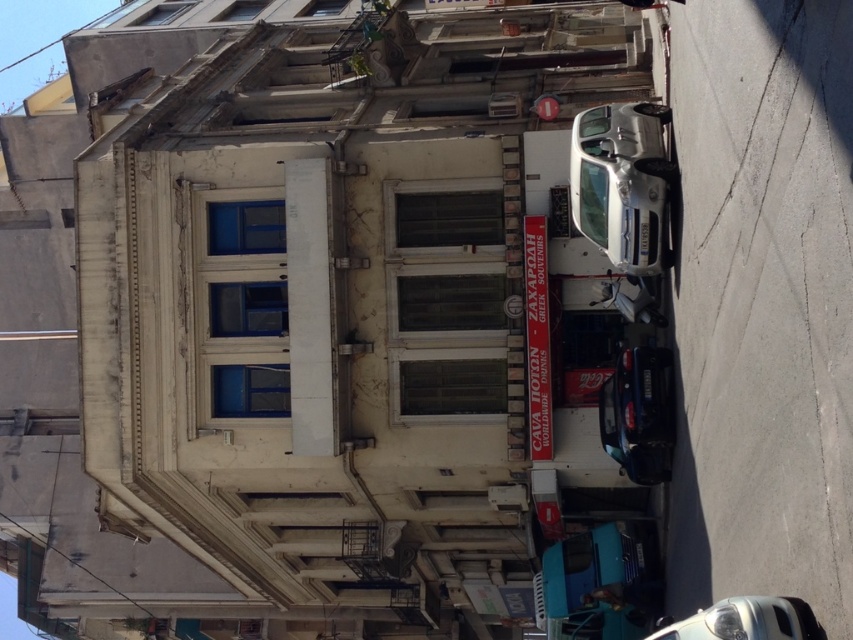
Question: From the image, what is the correct spatial relationship of silver metallic car at right in relation to teal matte van at lower center?

Choices:
 (A) above
 (B) below

Answer: (A)

Question: Based on their relative distances, which object is nearer to the silver metallic car at right?

Choices:
 (A) silver metallic car at lower right
 (B) shiny blue car at center

Answer: (B)

Question: Is shiny blue car at center to the left of silver metallic car at lower right from the viewer's perspective?

Choices:
 (A) yes
 (B) no

Answer: (B)

Question: Is silver metallic car at right below silver metallic car at lower right?

Choices:
 (A) yes
 (B) no

Answer: (B)

Question: Estimate the real-world distances between objects in this image. Which object is closer to the silver metallic car at right?

Choices:
 (A) shiny blue car at center
 (B) teal matte van at lower center

Answer: (A)

Question: Which of these objects is positioned closest to the teal matte van at lower center?

Choices:
 (A) shiny blue car at center
 (B) silver metallic car at lower right
 (C) silver metallic car at right

Answer: (A)